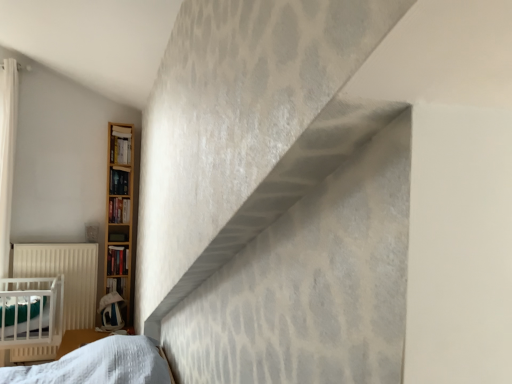
Question: Is hardcover book at left, the 3th book from the top, in front of wooden bookshelf at left, the fifth book when ordered from bottom to top?

Choices:
 (A) yes
 (B) no

Answer: (B)

Question: Is hardcover book at left, the 3th book from the top, located outside wooden bookshelf at left, the fifth book when ordered from bottom to top?

Choices:
 (A) no
 (B) yes

Answer: (B)

Question: Is hardcover book at left, which ranks as the third book in bottom-to-top order, smaller than wooden bookshelf at left, the fifth book when ordered from bottom to top?

Choices:
 (A) yes
 (B) no

Answer: (A)

Question: From the image's perspective, is hardcover book at left, which ranks as the third book in bottom-to-top order, over wooden bookshelf at left, the fifth book when ordered from bottom to top?

Choices:
 (A) no
 (B) yes

Answer: (A)

Question: Is hardcover book at left, the 3th book from the top, facing away from wooden bookshelf at left, the fifth book when ordered from bottom to top?

Choices:
 (A) yes
 (B) no

Answer: (B)

Question: Considering the relative positions of matte black bookshelf at left, arranged as the 4th book when ordered from the bottom, and white textured sheet at lower left in the image provided, is matte black bookshelf at left, arranged as the 4th book when ordered from the bottom, to the left or to the right of white textured sheet at lower left?

Choices:
 (A) left
 (B) right

Answer: (B)

Question: Choose the correct answer: Is matte black bookshelf at left, arranged as the 4th book when ordered from the bottom, inside white textured sheet at lower left or outside it?

Choices:
 (A) outside
 (B) inside

Answer: (A)

Question: From a real-world perspective, relative to white textured sheet at lower left, is matte black bookshelf at left, arranged as the 4th book when ordered from the bottom, vertically above or below?

Choices:
 (A) above
 (B) below

Answer: (A)

Question: In terms of height, does matte black bookshelf at left, arranged as the 4th book when ordered from the bottom, look taller or shorter compared to white textured sheet at lower left?

Choices:
 (A) tall
 (B) short

Answer: (A)

Question: Based on their positions, is matte black bookshelf at left, arranged as the 4th book when ordered from the bottom, located to the left or right of white matte radiator at left?

Choices:
 (A) right
 (B) left

Answer: (A)

Question: Relative to white matte radiator at left, is matte black bookshelf at left, the 2th book viewed from the top, in front or behind?

Choices:
 (A) behind
 (B) front

Answer: (A)

Question: In terms of width, does matte black bookshelf at left, arranged as the 4th book when ordered from the bottom, look wider or thinner when compared to white matte radiator at left?

Choices:
 (A) thin
 (B) wide

Answer: (B)

Question: From the image's perspective, is matte black bookshelf at left, the 2th book viewed from the top, located above or below white matte radiator at left?

Choices:
 (A) above
 (B) below

Answer: (A)

Question: From a real-world perspective, is wooden bookshelf at left, the fifth book when ordered from bottom to top, positioned above or below hardcover book at left, which ranks as the third book in bottom-to-top order?

Choices:
 (A) below
 (B) above

Answer: (B)

Question: Is wooden bookshelf at left, which appears as the first book when viewed from the top, wider or thinner than hardcover book at left, which ranks as the third book in bottom-to-top order?

Choices:
 (A) thin
 (B) wide

Answer: (B)